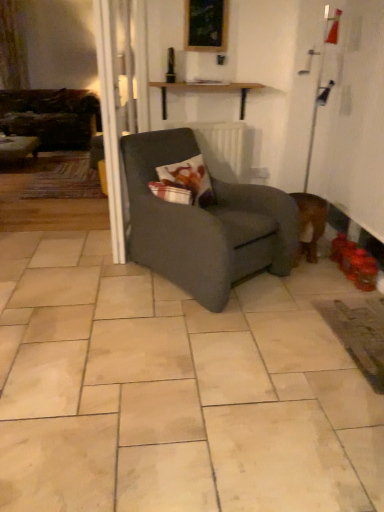
Question: Considering their positions, is printed fabric pillow at center located in front of or behind velvet dark brown couch at left?

Choices:
 (A) front
 (B) behind

Answer: (A)

Question: Considering the positions of printed fabric pillow at center and velvet dark brown couch at left in the image, is printed fabric pillow at center bigger or smaller than velvet dark brown couch at left?

Choices:
 (A) big
 (B) small

Answer: (B)

Question: Estimate the real-world distances between objects in this image. Which object is farther from the white textured radiator at center?

Choices:
 (A) wooden shelf at upper center, which is the 1th table in right-to-left order
 (B) wooden picture frame at upper center
 (C) printed fabric pillow at center
 (D) matte wooden table at left, placed as the second table when sorted from front to back
 (E) dark gray fabric chair at center

Answer: (D)

Question: Which of these objects is positioned closest to the white glossy screen door at left?

Choices:
 (A) velvet dark brown couch at left
 (B) wooden shelf at upper center, which is the first table from front to back
 (C) wooden picture frame at upper center
 (D) dark gray fabric chair at center
 (E) matte wooden table at left, acting as the second table starting from the right

Answer: (D)